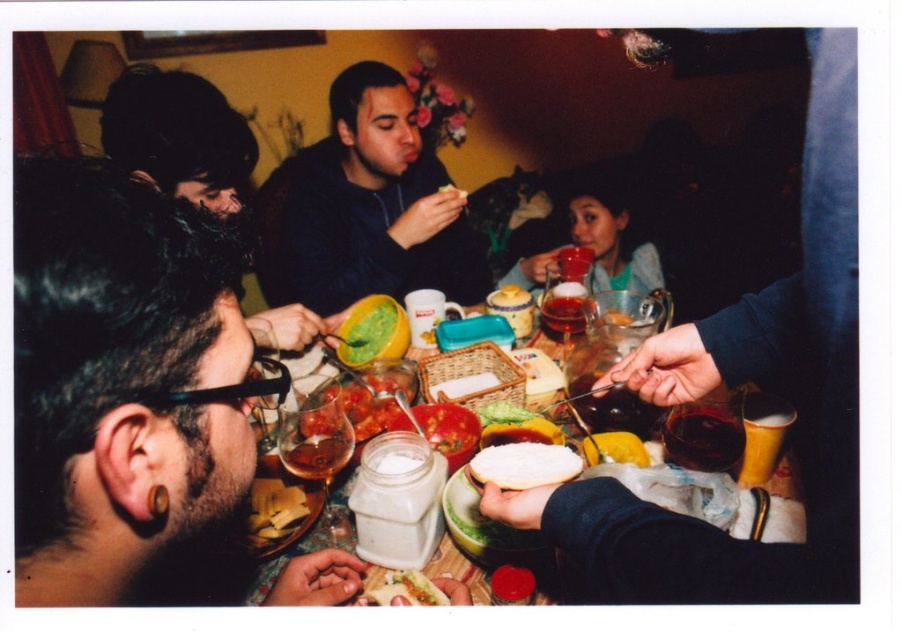
Question: From the image, what is the correct spatial relationship of white bread at center in relation to translucent glass cup at center?

Choices:
 (A) left
 (B) right

Answer: (A)

Question: Observing the image, what is the correct spatial positioning of yellow plastic cup at lower right in reference to green matte guacamole at center?

Choices:
 (A) right
 (B) left

Answer: (A)

Question: Considering the real-world distances, which object is closest to the green smoothie at center?

Choices:
 (A) translucent glass cup at center
 (B) smooth white bread at center
 (C) yellow matte lemon at center

Answer: (A)

Question: Is white matte bread at center further to the viewer compared to yellow plastic cup at lower right?

Choices:
 (A) yes
 (B) no

Answer: (B)

Question: Which is nearer to the dark brown hair at center?

Choices:
 (A) dark red glass at center
 (B) translucent glass wine at center
 (C) smooth white bread at center
 (D) translucent glass cup at center

Answer: (C)

Question: Which object is positioned farthest from the dark brown hair at center?

Choices:
 (A) translucent glass wine at center
 (B) yellow plastic cup at lower right
 (C) golden crispy chips at lower left
 (D) smooth white bread at center

Answer: (B)